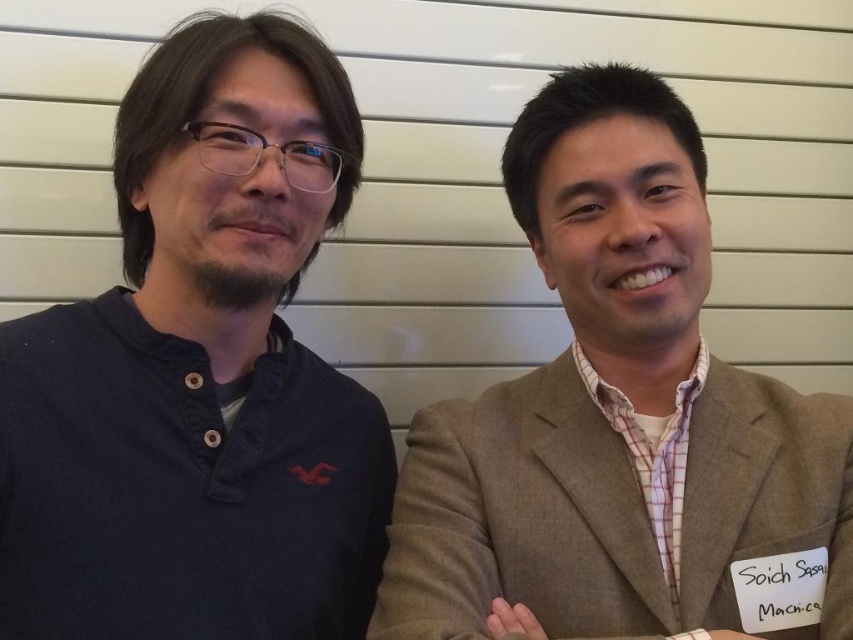
Is dark blue button-up shirt at left positioned at the back of brown textured suit at right?

No, dark blue button-up shirt at left is in front of brown textured suit at right.

Does dark blue button-up shirt at left appear on the left side of brown textured suit at right?

Correct, you'll find dark blue button-up shirt at left to the left of brown textured suit at right.

Is point (190, 372) positioned in front of point (631, 584)?

No, (190, 372) is further to viewer.

At what (x,y) coordinates should I click in order to perform the action: click on dark blue button-up shirt at left. Please return your answer as a coordinate pair (x, y). The image size is (853, 640). Looking at the image, I should click on (199, 372).